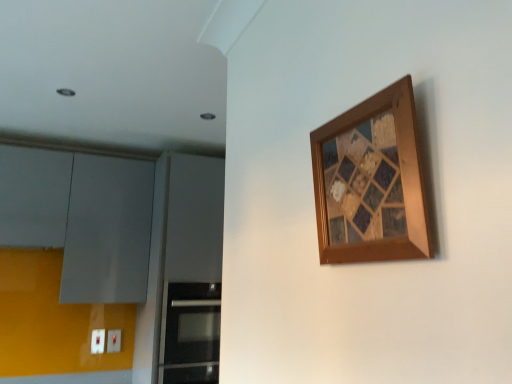
Question: Should I look upward or downward to see wooden mosaic art at upper right?

Choices:
 (A) up
 (B) down

Answer: (A)